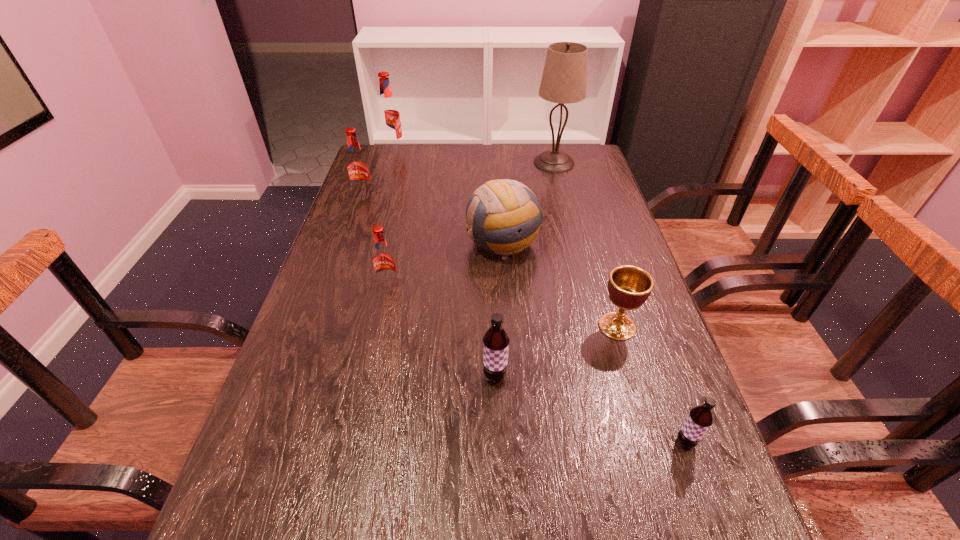
The height and width of the screenshot is (540, 960). Identify the location of the sixth farthest object. (629, 286).

This screenshot has width=960, height=540. In order to click on golden chalice in this screenshot , I will do click(629, 286).

Identify the location of the right brown root beer. The image size is (960, 540). (700, 418).

Locate an element on the screen. The height and width of the screenshot is (540, 960). the smaller brown root beer is located at coordinates (700, 418).

Locate an element on the screen. free point located on the front-facing side of the lampshade is located at coordinates (472, 163).

Find the location of a particular element. The image size is (960, 540). vacant area situated on the front-facing side of the lampshade is located at coordinates (432, 163).

Where is `vacant position located 0.240m on the front-facing side of the lampshade`? vacant position located 0.240m on the front-facing side of the lampshade is located at coordinates (464, 163).

The image size is (960, 540). What are the coordinates of `free point located 0.370m on the front of the tallest root beer` in the screenshot? It's located at (374, 213).

Locate an element on the screen. The height and width of the screenshot is (540, 960). vacant region located on the right of the second tallest root beer is located at coordinates (486, 198).

Where is `vacant space situated 0.260m on the front of the volleyball`? The height and width of the screenshot is (540, 960). vacant space situated 0.260m on the front of the volleyball is located at coordinates (509, 347).